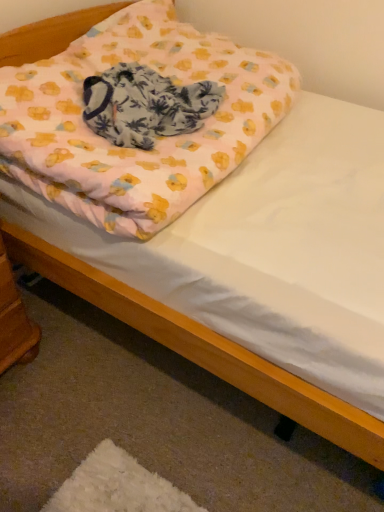
Question: Would you say wooden changing table at lower left is a long distance from pink fabric blanket at center?

Choices:
 (A) no
 (B) yes

Answer: (A)

Question: Is wooden changing table at lower left beside pink fabric blanket at center?

Choices:
 (A) no
 (B) yes

Answer: (A)

Question: Does wooden changing table at lower left have a greater width compared to pink fabric blanket at center?

Choices:
 (A) no
 (B) yes

Answer: (A)

Question: Does wooden changing table at lower left turn towards pink fabric blanket at center?

Choices:
 (A) no
 (B) yes

Answer: (A)

Question: Considering the relative positions of wooden changing table at lower left and pink fabric blanket at center in the image provided, is wooden changing table at lower left behind pink fabric blanket at center?

Choices:
 (A) no
 (B) yes

Answer: (A)

Question: From a real-world perspective, is wooden changing table at lower left physically below pink fabric blanket at center?

Choices:
 (A) yes
 (B) no

Answer: (A)

Question: Does pink fabric blanket at center have a smaller size compared to pink fabric pillow at upper center?

Choices:
 (A) no
 (B) yes

Answer: (B)

Question: Is pink fabric blanket at center outside pink fabric pillow at upper center?

Choices:
 (A) yes
 (B) no

Answer: (B)

Question: Is pink fabric blanket at center bigger than pink fabric pillow at upper center?

Choices:
 (A) yes
 (B) no

Answer: (B)

Question: Is pink fabric blanket at center to the right of pink fabric pillow at upper center from the viewer's perspective?

Choices:
 (A) yes
 (B) no

Answer: (B)

Question: From the image's perspective, is pink fabric blanket at center beneath pink fabric pillow at upper center?

Choices:
 (A) yes
 (B) no

Answer: (A)

Question: From a real-world perspective, is pink fabric blanket at center positioned over pink fabric pillow at upper center based on gravity?

Choices:
 (A) yes
 (B) no

Answer: (A)

Question: Can you see pink fabric pillow at upper center touching wooden changing table at lower left?

Choices:
 (A) yes
 (B) no

Answer: (B)